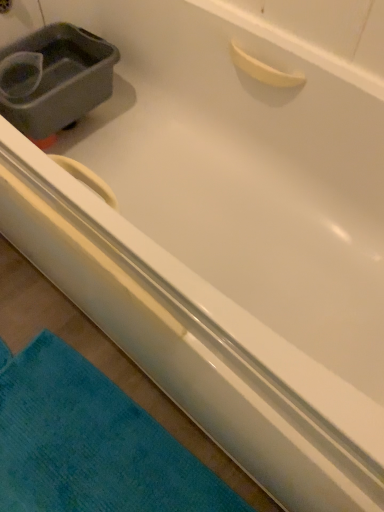
Question: Does teal soft towel at lower left have a larger size compared to gray plastic sink at upper left?

Choices:
 (A) yes
 (B) no

Answer: (B)

Question: From the image's perspective, is teal soft towel at lower left beneath gray plastic sink at upper left?

Choices:
 (A) yes
 (B) no

Answer: (A)

Question: Does teal soft towel at lower left appear on the right side of gray plastic sink at upper left?

Choices:
 (A) yes
 (B) no

Answer: (A)

Question: From a real-world perspective, is teal soft towel at lower left located beneath gray plastic sink at upper left?

Choices:
 (A) yes
 (B) no

Answer: (A)

Question: Is teal soft towel at lower left wider than gray plastic sink at upper left?

Choices:
 (A) no
 (B) yes

Answer: (B)

Question: Is there a large distance between teal soft towel at lower left and gray plastic sink at upper left?

Choices:
 (A) no
 (B) yes

Answer: (A)

Question: Does gray plastic sink at upper left have a lesser height compared to teal soft towel at lower left?

Choices:
 (A) no
 (B) yes

Answer: (A)

Question: Can you confirm if gray plastic sink at upper left is positioned to the left of teal soft towel at lower left?

Choices:
 (A) yes
 (B) no

Answer: (A)

Question: Is gray plastic sink at upper left smaller than teal soft towel at lower left?

Choices:
 (A) yes
 (B) no

Answer: (B)

Question: From the image's perspective, does gray plastic sink at upper left appear lower than teal soft towel at lower left?

Choices:
 (A) no
 (B) yes

Answer: (A)

Question: Considering the relative sizes of gray plastic sink at upper left and teal soft towel at lower left in the image provided, is gray plastic sink at upper left taller than teal soft towel at lower left?

Choices:
 (A) yes
 (B) no

Answer: (A)

Question: Is gray plastic sink at upper left aimed at teal soft towel at lower left?

Choices:
 (A) yes
 (B) no

Answer: (B)

Question: From a real-world perspective, is teal soft towel at lower left positioned above or below gray plastic sink at upper left?

Choices:
 (A) above
 (B) below

Answer: (B)